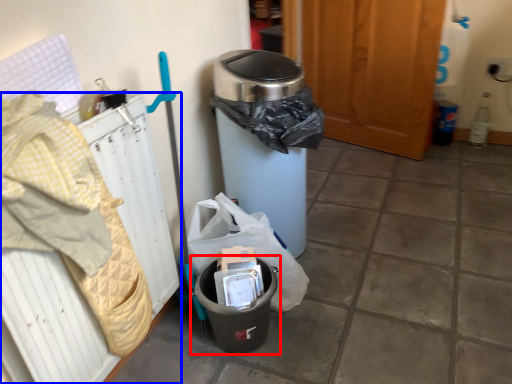
Question: Which point is further to the camera, waste container (highlighted by a red box) or radiator (highlighted by a blue box)?

Choices:
 (A) waste container
 (B) radiator

Answer: (A)